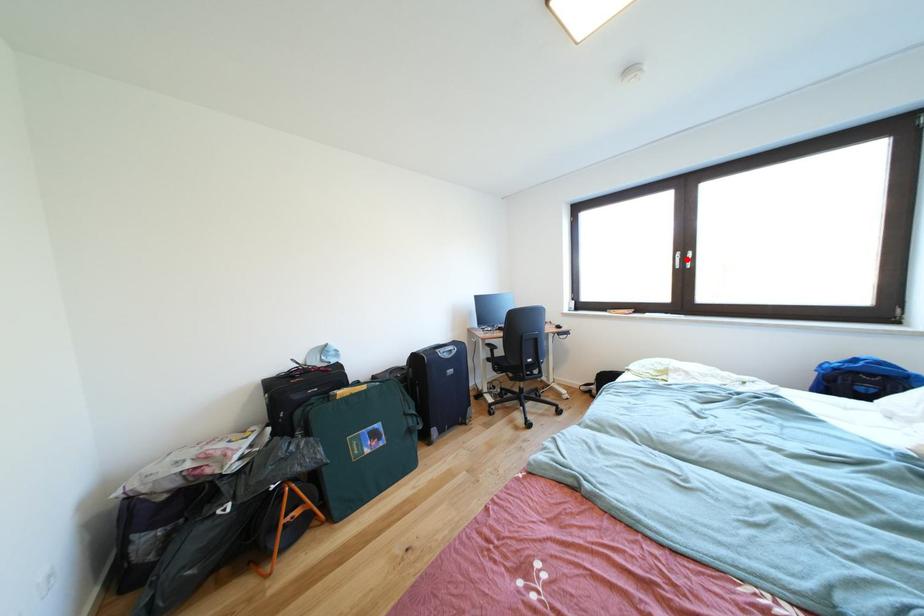
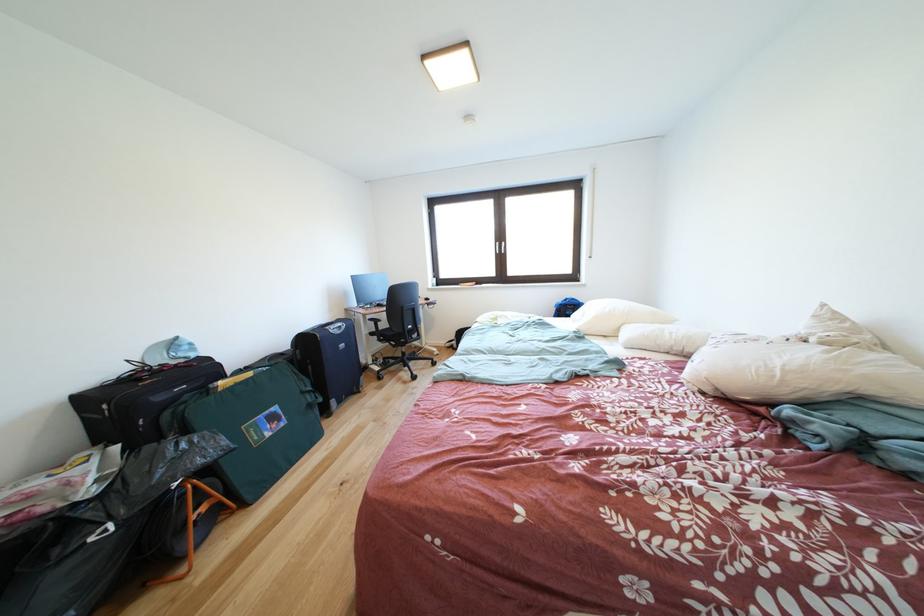
Question: I am providing you with two images of the same scene from different viewpoints. A red point is marked on the first image. Can you still see the location of the red point in image 2?

Choices:
 (A) Yes
 (B) No

Answer: (A)